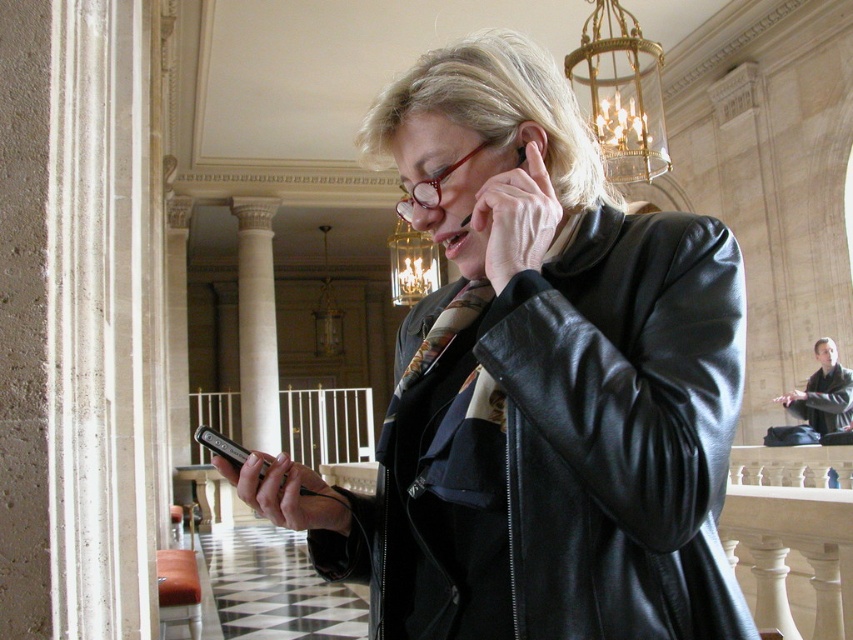
In the scene shown: You are an interior designer assessing the proportions of items in the room. Given the black leather jacket at center and the white marble column at center, which object is taller?

The white marble column at center is taller than the black leather jacket at center.

You are a visitor in this historical building and want to take a photo of the white marble column at center without getting too close. If your camera has a maximum zoom range of 20 meters, will you be able to capture the column clearly from your current position?

The white marble column at center is 22.81 meters away from the viewer. Since the camera can only zoom up to 20 meters, you won

You are an interior designer assessing the space for a new sculpture. The sculpture will be placed between the white marble column at center and the dark brown leather jacket at right. Considering their sizes, which object should the sculpture be positioned closer to for balance?

The sculpture should be positioned closer to the dark brown leather jacket at right because the white marble column at center is larger in size and would dominate the space, requiring the sculpture to balance near the smaller object.